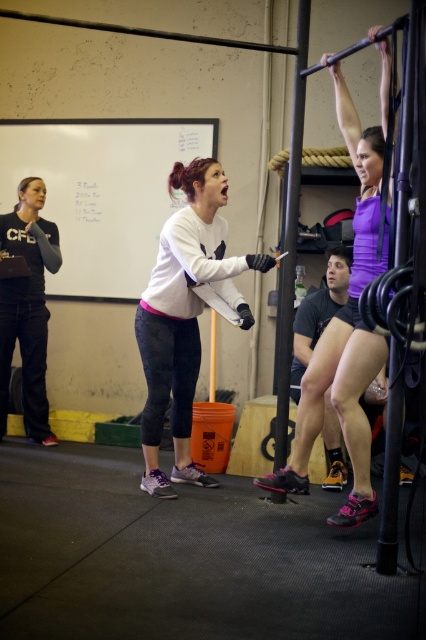
Question: Estimate the real-world distances between objects in this image. Which object is farther from the white matte sweatshirt at center?

Choices:
 (A) black matte sweatshirt at left
 (B) purple matte tank top at upper center
 (C) matte black shorts at center

Answer: (A)

Question: Which object appears closest to the camera in this image?

Choices:
 (A) black matte sweatshirt at left
 (B) white matte sweatshirt at center

Answer: (B)

Question: Can you confirm if white matte sweatshirt at center is positioned above black matte sweatshirt at left?

Choices:
 (A) no
 (B) yes

Answer: (A)

Question: In this image, where is black matte sweatshirt at left located relative to matte black shorts at center?

Choices:
 (A) left
 (B) right

Answer: (A)

Question: Based on their relative distances, which object is farther from the purple matte tank top at upper center?

Choices:
 (A) black matte sweatshirt at left
 (B) matte black shorts at center
 (C) white matte sweatshirt at center

Answer: (A)

Question: Does white matte sweatshirt at center have a smaller size compared to matte black shorts at center?

Choices:
 (A) no
 (B) yes

Answer: (A)